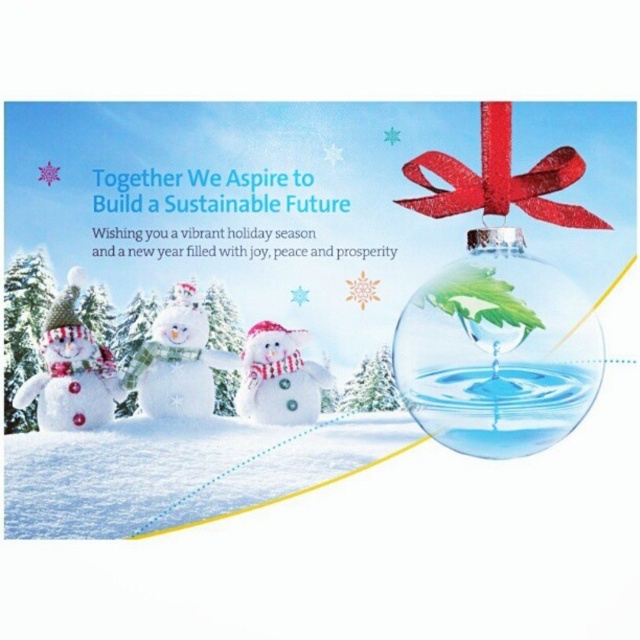
Is point (28, 468) positioned after point (308, 384)?

That is False.

Does white fluffy snow at lower left appear on the right side of white matte snowman at center?

Incorrect, white fluffy snow at lower left is not on the right side of white matte snowman at center.

Does point (387, 435) come farther from viewer compared to point (250, 333)?

No.

Locate an element on the screen. The height and width of the screenshot is (640, 640). white fluffy snow at lower left is located at coordinates (177, 470).

Does white matte snowman at left have a greater width compared to white matte snowman at center?

Indeed, white matte snowman at left has a greater width compared to white matte snowman at center.

This screenshot has width=640, height=640. Describe the element at coordinates (72, 371) in the screenshot. I see `white matte snowman at left` at that location.

Measure the distance between white matte snowman at left and camera.

white matte snowman at left and camera are 3.54 feet apart from each other.

Where is `white matte snowman at left`? This screenshot has width=640, height=640. white matte snowman at left is located at coordinates (72, 371).

Does white matte snowman at left appear on the left side of white fluffy snowman at center?

Indeed, white matte snowman at left is positioned on the left side of white fluffy snowman at center.

Does white matte snowman at left have a greater width compared to white fluffy snowman at center?

Incorrect, white matte snowman at left's width does not surpass white fluffy snowman at center's.

Between point (109, 362) and point (205, 336), which one is positioned behind?

Point (205, 336)

Find the location of a particular element. Image resolution: width=640 pixels, height=640 pixels. white matte snowman at left is located at coordinates (72, 371).